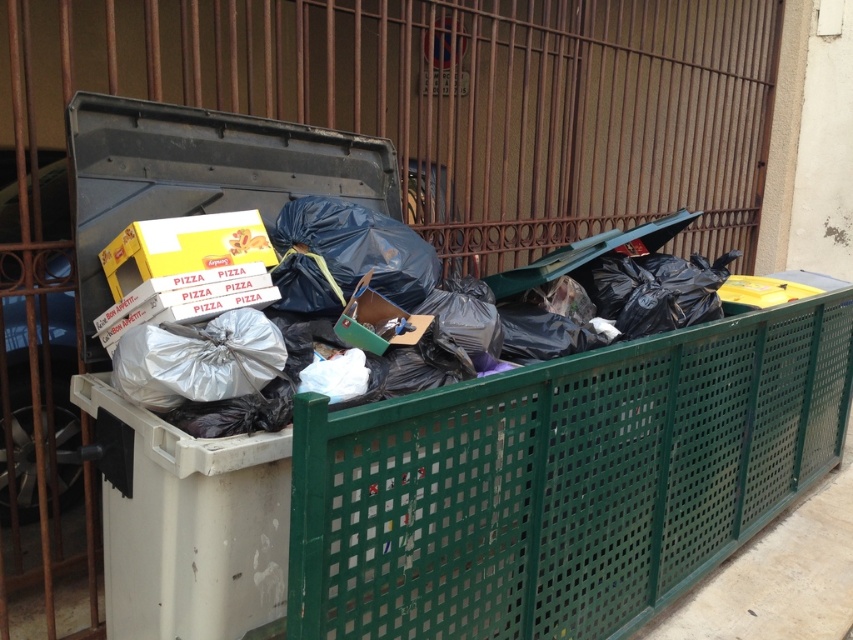
You are a sanitation worker who needs to empty the trash bin. You see the shiny metallic trash bin at center and the white cardboard pizza box at upper left. Which object is located below the other?

The shiny metallic trash bin at center is positioned under the white cardboard pizza box at upper left, so the trash bin is below the pizza box.

You are a sanitation worker checking if the white cardboard pizza box at upper left can fit inside the shiny metallic trash bin at center. Based on their sizes, can the pizza box fit vertically inside the trash bin?

The shiny metallic trash bin at center is taller than the white cardboard pizza box at upper left, so the pizza box can fit vertically inside the trash bin.

You are standing in front of a trash bin near a security gate. There is a point at coordinates [569,316]. What object is located at that point?

The shiny metallic trash bin at center is located at point [569,316].